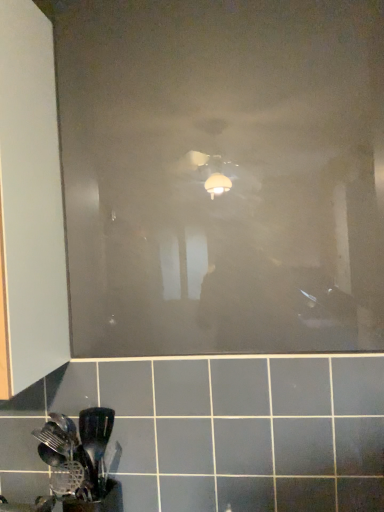
Question: Considering the positions of matte white cabinet at left and transparent matte glass door at center in the image, is matte white cabinet at left bigger or smaller than transparent matte glass door at center?

Choices:
 (A) big
 (B) small

Answer: (A)

Question: Looking at their shapes, would you say matte white cabinet at left is wider or thinner than transparent matte glass door at center?

Choices:
 (A) thin
 (B) wide

Answer: (B)

Question: Considering the real-world distances, which object is closest to the transparent matte glass door at center?

Choices:
 (A) black plastic spatula at lower left
 (B) matte white cabinet at left

Answer: (B)

Question: Which of these objects is positioned farthest from the matte white cabinet at left?

Choices:
 (A) transparent matte glass door at center
 (B) black plastic spatula at lower left

Answer: (B)